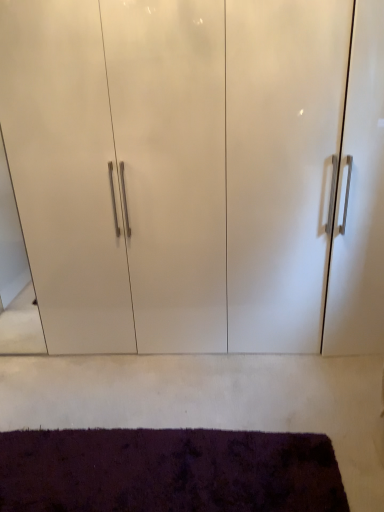
The height and width of the screenshot is (512, 384). I want to click on free space above dark purple shaggy rug at lower center (from a real-world perspective), so click(150, 462).